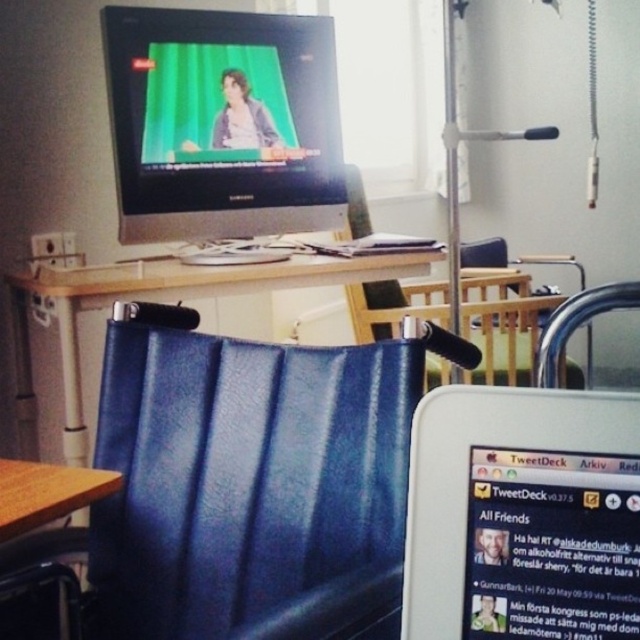
Question: Which object appears closest to the camera in this image?

Choices:
 (A) blue leather swivel chair at center
 (B) wooden desk at center

Answer: (A)

Question: Which point is closer to the camera?

Choices:
 (A) brown wooden table at lower left
 (B) blue leather swivel chair at center

Answer: (B)

Question: Is blue leather swivel chair at center smaller than wooden desk at center?

Choices:
 (A) yes
 (B) no

Answer: (A)

Question: Does blue leather swivel chair at center appear on the left side of brown wooden table at lower left?

Choices:
 (A) yes
 (B) no

Answer: (B)

Question: Is the position of matte black monitor at upper center more distant than that of brown wooden table at lower left?

Choices:
 (A) no
 (B) yes

Answer: (B)

Question: Which of the following is the farthest from the observer?

Choices:
 (A) blue leather swivel chair at center
 (B) matte black monitor at upper center
 (C) wooden desk at center
 (D) brown wooden table at lower left

Answer: (B)